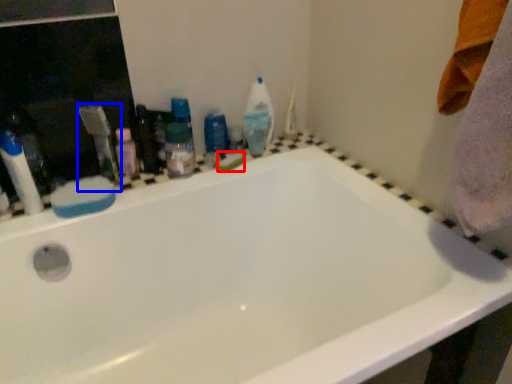
Question: Which point is further to the camera, soap (highlighted by a red box) or toothbrush (highlighted by a blue box)?

Choices:
 (A) soap
 (B) toothbrush

Answer: (A)